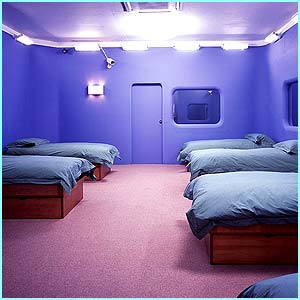
Where is `bed`? bed is located at coordinates (227, 160).